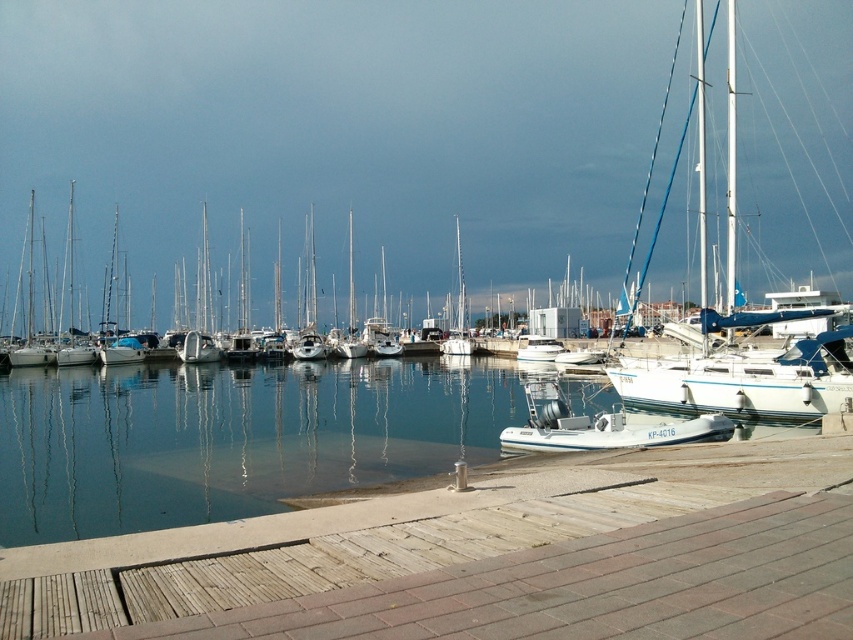
You are a sailor who wants to board the white rubber dinghy at center and the white glossy boat at center. Which vessel is taller?

The white rubber dinghy at center is much taller than the white glossy boat at center.